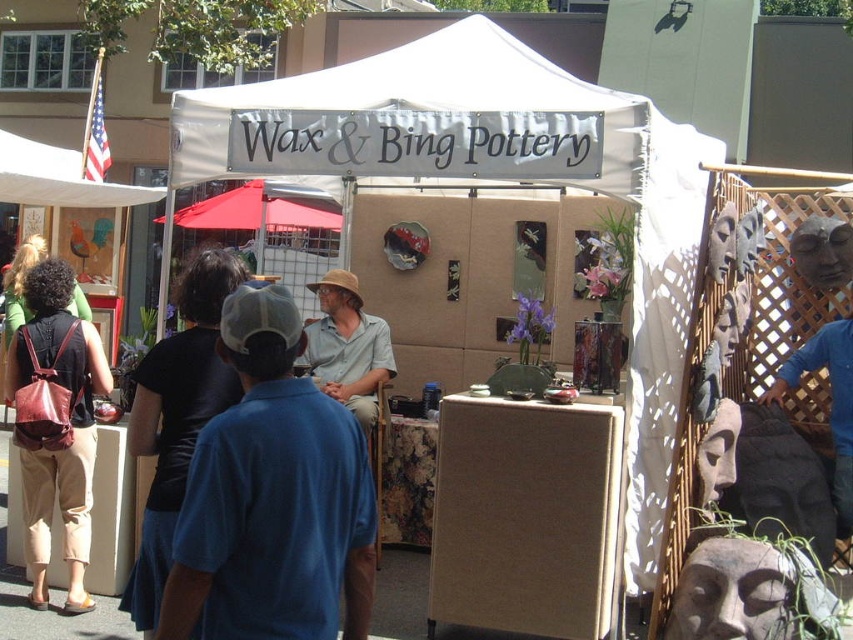
Question: Is blue cotton shirt at center smaller than matte khaki shirt at center?

Choices:
 (A) no
 (B) yes

Answer: (A)

Question: Among these objects, which one is farthest from the camera?

Choices:
 (A) red fabric canopy at upper center
 (B) matte khaki shirt at center
 (C) matte gray stone head at right
 (D) blue cotton shirt at center

Answer: (A)

Question: Which is nearer to the matte gray stone head at right?

Choices:
 (A) red fabric canopy at upper center
 (B) blue cotton shirt at center
 (C) white fabric canopy at upper left

Answer: (B)

Question: Does black fabric at center come in front of red fabric canopy at upper center?

Choices:
 (A) yes
 (B) no

Answer: (A)

Question: Observing the image, what is the correct spatial positioning of matte gray stone head at right in reference to matte khaki shirt at center?

Choices:
 (A) below
 (B) above

Answer: (A)

Question: Which object appears farthest from the camera in this image?

Choices:
 (A) matte gray stone head at right
 (B) white fabric canopy at upper left

Answer: (B)